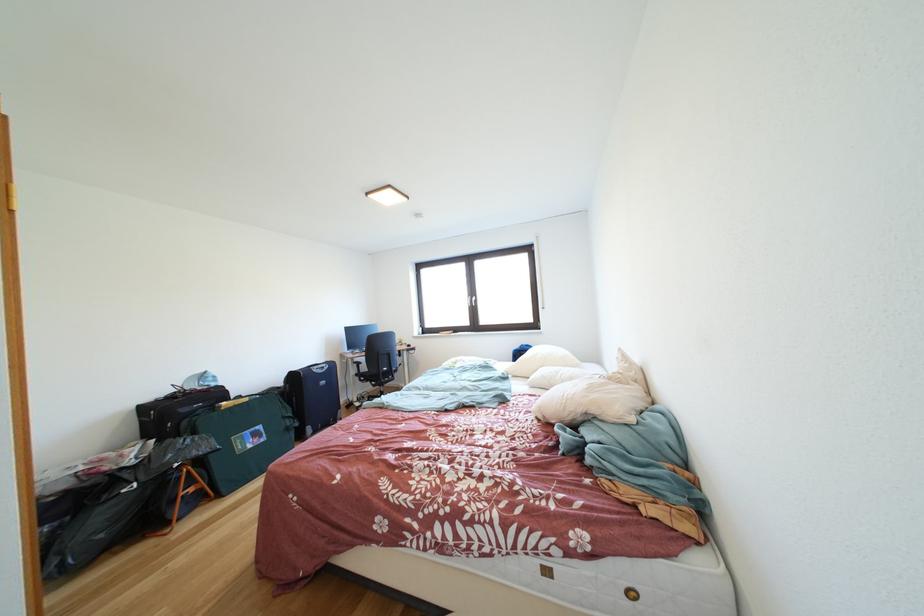
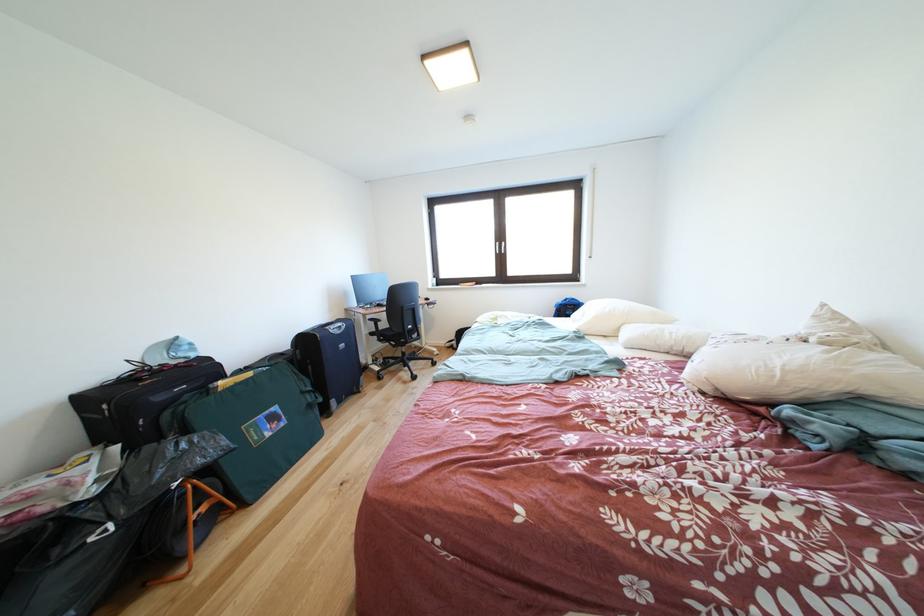
Locate, in the second image, the point that corresponds to point (383, 391) in the first image.

(403, 351)